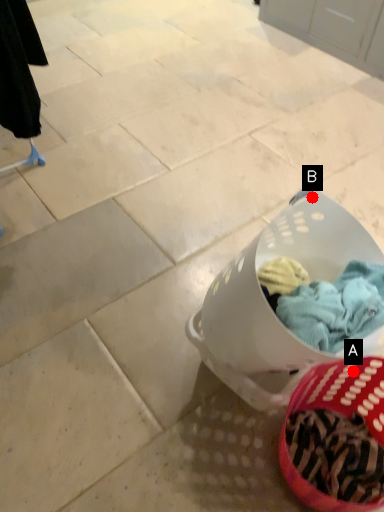
Question: Two points are circled on the image, labeled by A and B beside each circle. Which point is closer to the camera taking this photo?

Choices:
 (A) A is closer
 (B) B is closer

Answer: (A)